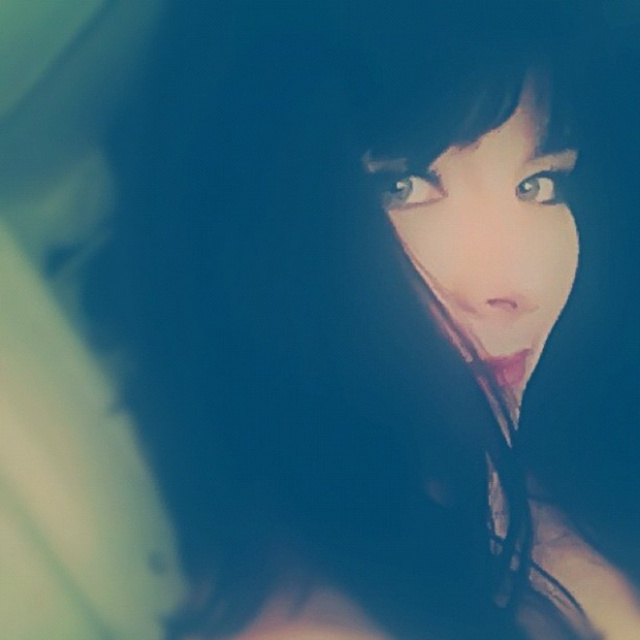
Does point (550, 269) lie in front of point (513, 100)?

That is False.

Describe the element at coordinates (493, 236) in the screenshot. The image size is (640, 640). I see `smooth skin face at center` at that location.

Which is behind, point (512, 275) or point (449, 141)?

Point (512, 275)

Identify the location of smooth skin face at center. (493, 236).